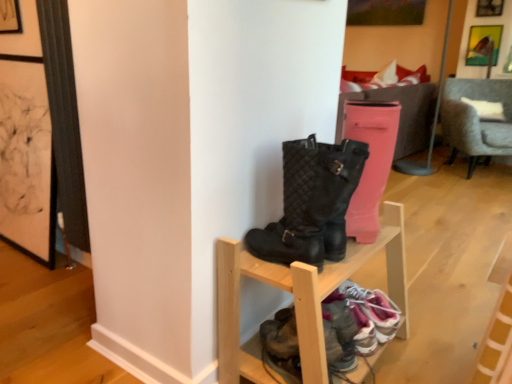
Question: Is metallic gold picture frame at upper right outside of gray fabric chair at right?

Choices:
 (A) no
 (B) yes

Answer: (B)

Question: Does metallic gold picture frame at upper right have a greater width compared to gray fabric chair at right?

Choices:
 (A) no
 (B) yes

Answer: (A)

Question: Is metallic gold picture frame at upper right aimed at gray fabric chair at right?

Choices:
 (A) yes
 (B) no

Answer: (A)

Question: From the image's perspective, does metallic gold picture frame at upper right appear higher than gray fabric chair at right?

Choices:
 (A) yes
 (B) no

Answer: (A)

Question: Is metallic gold picture frame at upper right positioned far away from gray fabric chair at right?

Choices:
 (A) no
 (B) yes

Answer: (A)

Question: Based on their sizes in the image, would you say pink fabric sneaker at lower right, placed as the 1th footwear when sorted from right to left, is bigger or smaller than gray fabric chair at right?

Choices:
 (A) big
 (B) small

Answer: (B)

Question: Is point (396, 314) positioned closer to the camera than point (458, 145)?

Choices:
 (A) farther
 (B) closer

Answer: (B)

Question: Visually, is pink fabric sneaker at lower right, acting as the second footwear starting from the left, positioned to the left or to the right of gray fabric chair at right?

Choices:
 (A) left
 (B) right

Answer: (A)

Question: From their relative heights in the image, would you say pink fabric sneaker at lower right, placed as the 1th footwear when sorted from right to left, is taller or shorter than gray fabric chair at right?

Choices:
 (A) short
 (B) tall

Answer: (A)

Question: In the image, is pink fabric sneaker at lower right, acting as the second footwear starting from the left, positioned in front of or behind leather sneakers at lower center, which appears as the 1th footwear when viewed from the left?

Choices:
 (A) front
 (B) behind

Answer: (B)

Question: Visually, is pink fabric sneaker at lower right, acting as the second footwear starting from the left, positioned to the left or to the right of leather sneakers at lower center, positioned as the second footwear in right-to-left order?

Choices:
 (A) left
 (B) right

Answer: (B)

Question: Does point (384, 324) appear closer or farther from the camera than point (364, 321)?

Choices:
 (A) closer
 (B) farther

Answer: (B)

Question: Do you think pink fabric sneaker at lower right, placed as the 1th footwear when sorted from right to left, is within leather sneakers at lower center, which appears as the 1th footwear when viewed from the left, or outside of it?

Choices:
 (A) outside
 (B) inside

Answer: (A)

Question: Would you say black quilted boots at center is to the left or to the right of gray fabric chair at right in the picture?

Choices:
 (A) left
 (B) right

Answer: (A)

Question: In the image, is black quilted boots at center positioned in front of or behind gray fabric chair at right?

Choices:
 (A) behind
 (B) front

Answer: (B)